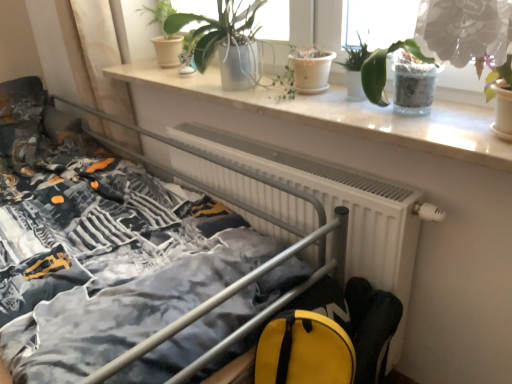
Identify the location of vacant space situated on the left part of green glossy plant at upper right, which appears as the first houseplant when viewed from the right. The image size is (512, 384). click(x=453, y=126).